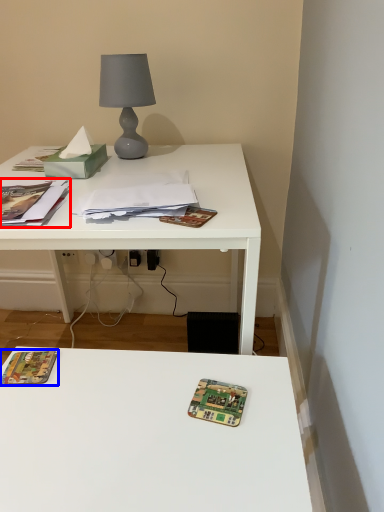
Question: Which of the following is the farthest to the observer, book (highlighted by a red box) or paperback book (highlighted by a blue box)?

Choices:
 (A) book
 (B) paperback book

Answer: (A)